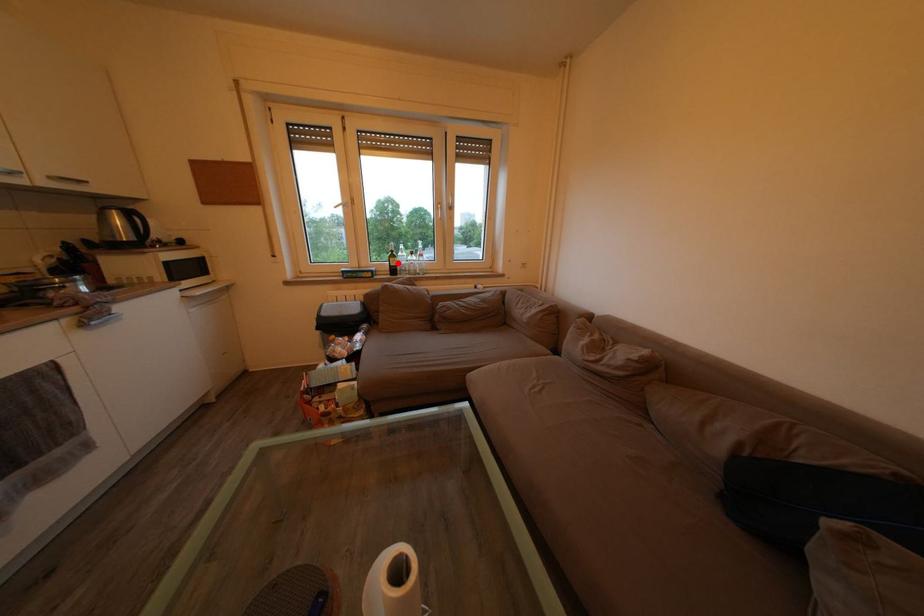
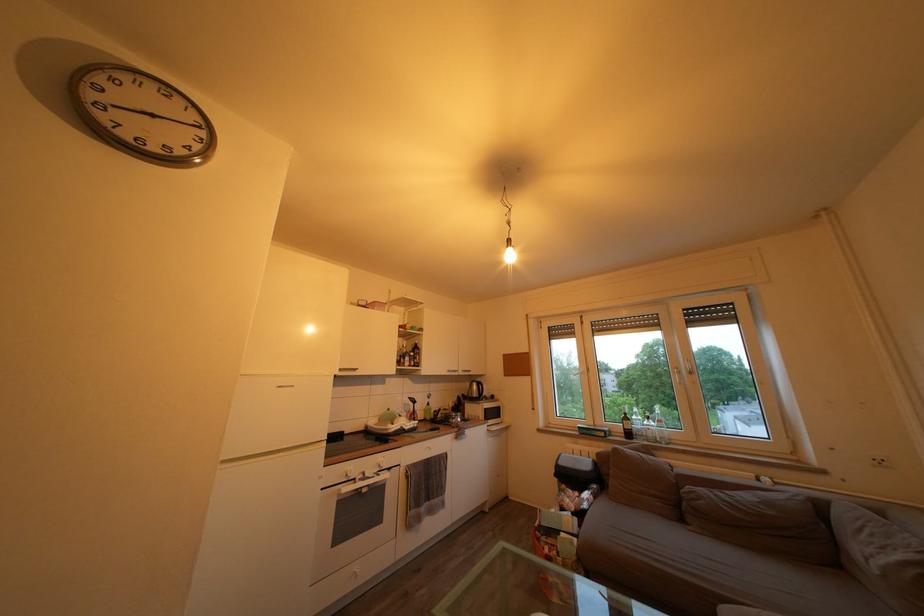
Question: I am providing you with two images of the same scene from different viewpoints. A red point is marked on the first image. At the location where the point appears in image 1, is it still visible in image 2?

Choices:
 (A) Yes
 (B) No

Answer: (A)